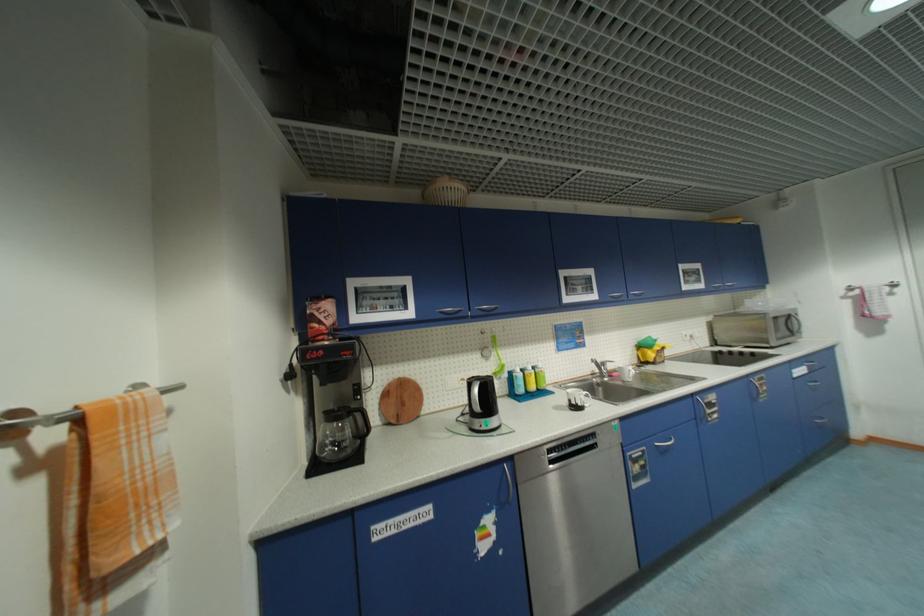
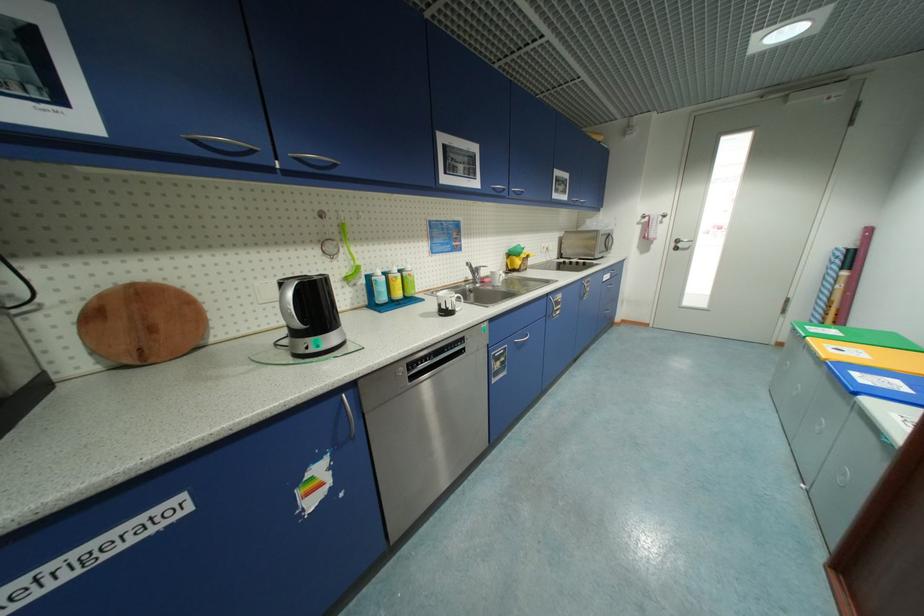
Locate, in the second image, the point that corresponds to (520,376) in the first image.

(380, 280)